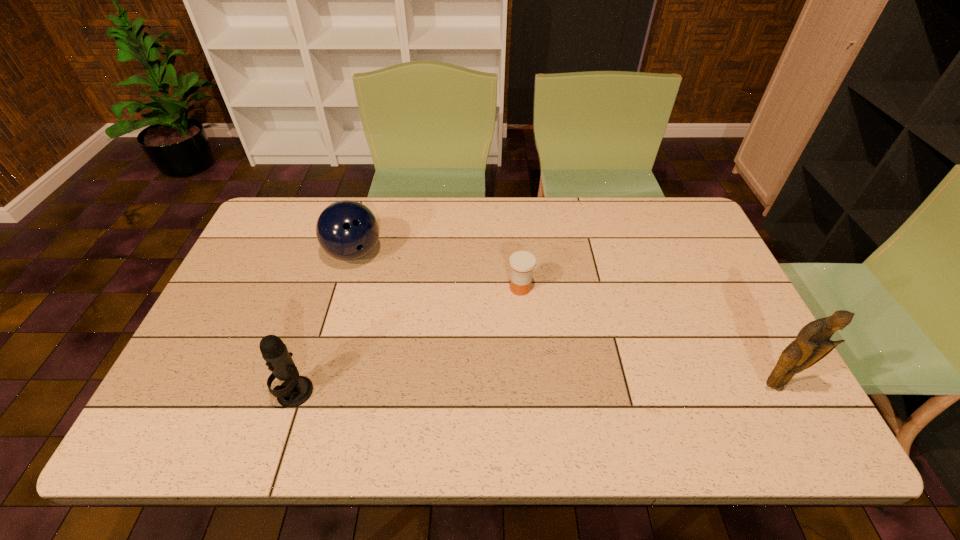
Find the location of `microphone`. microphone is located at coordinates (295, 390).

The height and width of the screenshot is (540, 960). What are the coordinates of `the rightmost object` in the screenshot? It's located at (812, 344).

Identify the location of the tallest object. (812, 344).

Where is `bowling ball`? The width and height of the screenshot is (960, 540). bowling ball is located at coordinates (347, 230).

Locate an element on the screen. This screenshot has width=960, height=540. the shortest object is located at coordinates (522, 263).

You are a GUI agent. You are given a task and a screenshot of the screen. Output one action in this format:
    pyautogui.click(x=<x>, y=<y>)
    Task: Click on the medicine
    The image size is (960, 540).
    Given the screenshot: What is the action you would take?
    pyautogui.click(x=522, y=263)

Find the location of a particular element. Image resolution: width=960 pixels, height=540 pixels. free spot located 0.050m on the right of the microphone is located at coordinates (334, 393).

The width and height of the screenshot is (960, 540). I want to click on vacant area situated 0.050m on the surface of the bowling ball near the finger holes, so click(385, 273).

At what (x,y) coordinates should I click in order to perform the action: click on vacant space located 0.160m on the surface of the bowling ball near the finger holes. Please return your answer as a coordinate pair (x, y). The width and height of the screenshot is (960, 540). Looking at the image, I should click on point(413,291).

Image resolution: width=960 pixels, height=540 pixels. I want to click on free space located on the surface of the bowling ball near the finger holes, so click(388, 275).